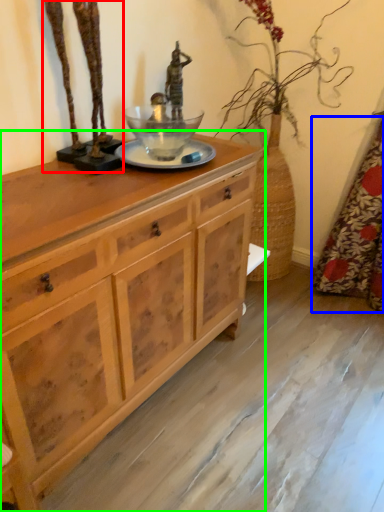
Question: Considering the real-world distances, which object is farthest from bronze statue (highlighted by a red box)? curtain (highlighted by a blue box) or chest of drawers (highlighted by a green box)?

Choices:
 (A) curtain
 (B) chest of drawers

Answer: (A)